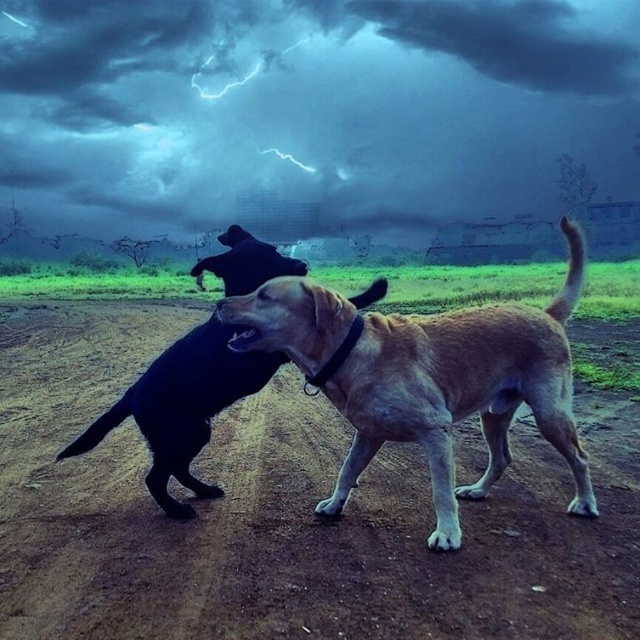
Question: Is brown dirt field at center to the right of light brown fur dog at center from the viewer's perspective?

Choices:
 (A) no
 (B) yes

Answer: (B)

Question: Can you confirm if dark cloudy sky at upper center is thinner than light brown fur dog at center?

Choices:
 (A) yes
 (B) no

Answer: (B)

Question: Which object appears farthest from the camera in this image?

Choices:
 (A) brown dirt field at center
 (B) light brown fur dog at center
 (C) shiny black dog at center

Answer: (C)

Question: Which object is positioned farthest from the light brown fur dog at center?

Choices:
 (A) dark cloudy sky at upper center
 (B) shiny black dog at center
 (C) brown dirt field at center

Answer: (A)

Question: Among these points, which one is farthest from the camera?

Choices:
 (A) (481, 449)
 (B) (184, 481)
 (C) (433, 332)
 (D) (20, 113)

Answer: (D)

Question: Is dark cloudy sky at upper center bigger than shiny black dog at center?

Choices:
 (A) yes
 (B) no

Answer: (A)